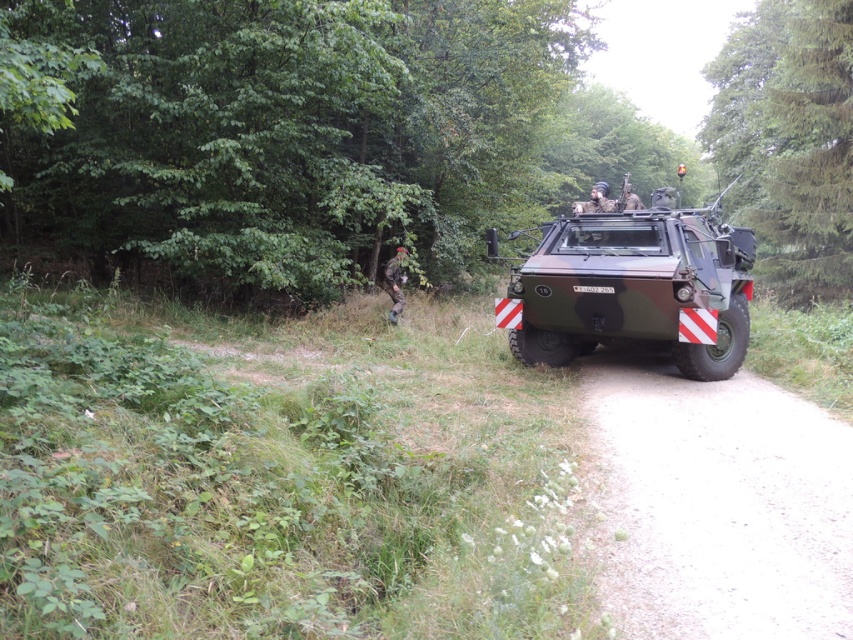
Based on the photo, is green matte vehicle at center thinner than dirt road at center?

In fact, green matte vehicle at center might be wider than dirt road at center.

Is green matte vehicle at center further to camera compared to dirt road at center?

Yes, it is behind dirt road at center.

Who is more distant from viewer, (850, 26) or (650, 472)?

Positioned behind is point (850, 26).

The image size is (853, 640). Find the location of `green matte vehicle at center`. green matte vehicle at center is located at coordinates (299, 134).

Locate an element on the screen. The height and width of the screenshot is (640, 853). green matte vehicle at center is located at coordinates (299, 134).

The width and height of the screenshot is (853, 640). Describe the element at coordinates (299, 134) in the screenshot. I see `green matte vehicle at center` at that location.

Where is `green matte vehicle at center`? green matte vehicle at center is located at coordinates (299, 134).

Can you confirm if dirt road at center is bigger than camouflage fabric uniform at center?

Incorrect, dirt road at center is not larger than camouflage fabric uniform at center.

Is point (699, 608) closer to viewer compared to point (399, 280)?

Yes, it is in front of point (399, 280).

The image size is (853, 640). I want to click on dirt road at center, so click(718, 506).